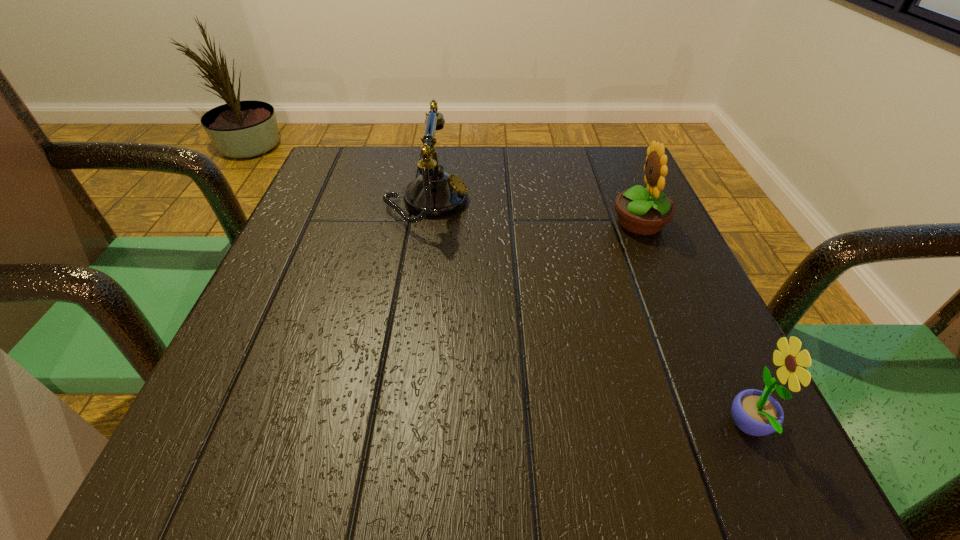
Find the location of a particular element. Image resolution: width=960 pixels, height=540 pixels. the leftmost object is located at coordinates tap(434, 193).

Where is `the farther sunflower`? the farther sunflower is located at coordinates (641, 211).

Locate an element on the screen. The image size is (960, 540). the nearest object is located at coordinates (757, 413).

Where is `free spot located on the dial of the leftmost object`? The image size is (960, 540). free spot located on the dial of the leftmost object is located at coordinates (631, 202).

I want to click on vacant area situated on the face of the farther sunflower, so click(546, 222).

Find the location of `free spot located 0.390m on the face of the farther sunflower`. free spot located 0.390m on the face of the farther sunflower is located at coordinates (414, 222).

The image size is (960, 540). What are the coordinates of `free space located 0.160m on the face of the farther sunflower` in the screenshot? It's located at (531, 222).

This screenshot has height=540, width=960. Identify the location of vacant space located 0.380m on the front-facing side of the nearest object. (429, 428).

Where is `vacant space located 0.150m on the front-facing side of the nearest object`? The image size is (960, 540). vacant space located 0.150m on the front-facing side of the nearest object is located at coordinates (610, 428).

Locate an element on the screen. The image size is (960, 540). free spot located 0.310m on the front-facing side of the nearest object is located at coordinates pyautogui.click(x=484, y=428).